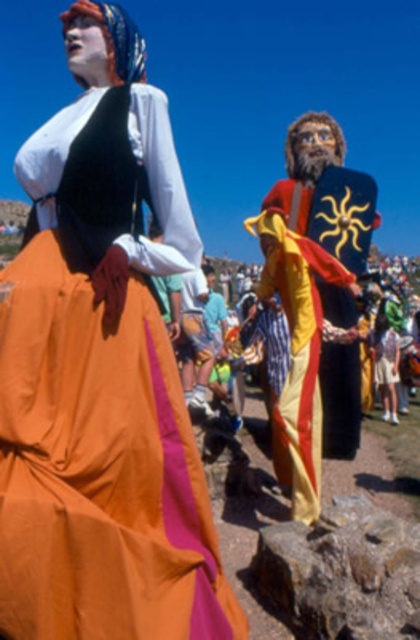
Is yellow satin robe at center further to the viewer compared to brown rough rock at lower center?

Yes, yellow satin robe at center is further from the viewer.

Can you confirm if yellow satin robe at center is positioned to the left of brown rough rock at lower center?

In fact, yellow satin robe at center is to the right of brown rough rock at lower center.

Which is behind, point (370, 228) or point (291, 532)?

The point (370, 228) is behind.

This screenshot has width=420, height=640. In order to click on yellow satin robe at center in this screenshot , I will do `click(299, 304)`.

Between matte orange skirt at center and yellow satin robe at center, which one is positioned higher?

Positioned higher is yellow satin robe at center.

Which is behind, point (49, 397) or point (307, 368)?

The point (307, 368) is behind.

Does point (110, 230) lie in front of point (309, 394)?

Yes, it is.

Where is `matte orange skirt at center`? This screenshot has width=420, height=640. matte orange skirt at center is located at coordinates (102, 372).

Is matte orange skirt at center to the right of brown rough rock at lower center from the viewer's perspective?

No, matte orange skirt at center is not to the right of brown rough rock at lower center.

Is point (92, 72) positioned in front of point (312, 604)?

No, (92, 72) is behind (312, 604).

Image resolution: width=420 pixels, height=640 pixels. What do you see at coordinates (102, 372) in the screenshot?
I see `matte orange skirt at center` at bounding box center [102, 372].

Where is `matte orange skirt at center`? The height and width of the screenshot is (640, 420). matte orange skirt at center is located at coordinates click(102, 372).